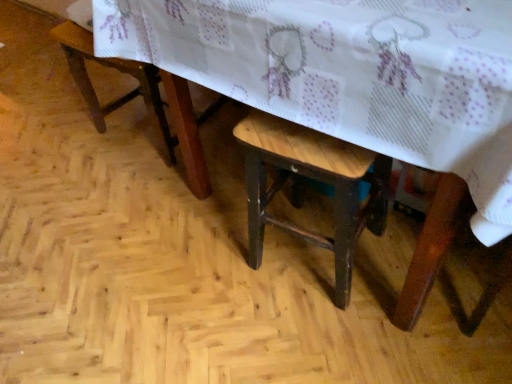
This screenshot has height=384, width=512. Find the location of `free spot to the left of wooden table at center`. free spot to the left of wooden table at center is located at coordinates pyautogui.click(x=104, y=242).